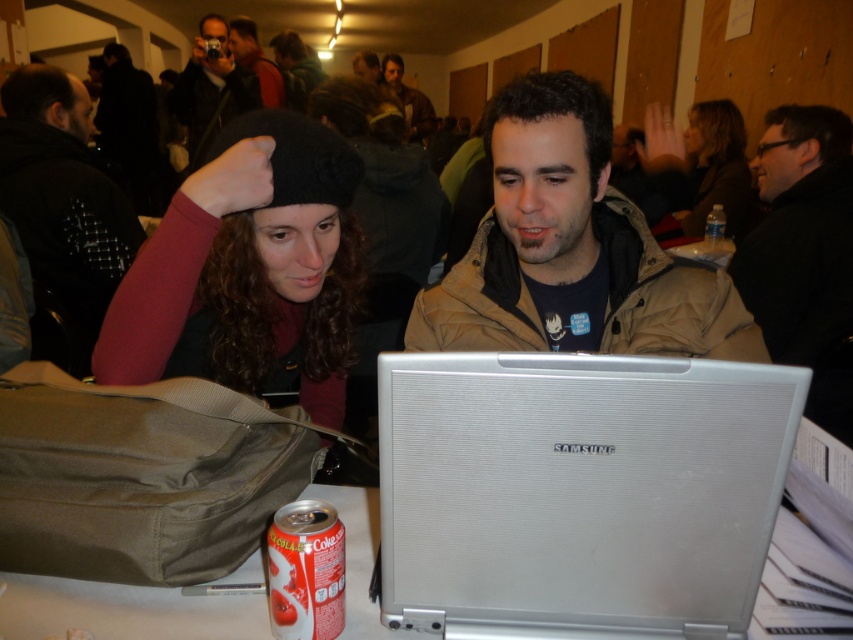
You are a photographer at the event and need to place both the matte black camera at upper center and the clear plastic bottle at upper right on a shelf. The shelf has a height limit of 12 inches. Which item might not fit if placed upright?

The matte black camera at upper center is much taller than the clear plastic bottle at upper right. Since the shelf has a height limit of 12 inches, the matte black camera at upper center might not fit if placed upright.

You are setting up a photo shoot in the described scene. The matte black camera at upper center needs to be moved to a new position that is closer to the laptop screen. Which object should you adjust the camera position relative to, and why?

The matte black camera at upper center should be moved closer to the laptop screen. Since the camera is currently at point (212, 88), adjusting its position towards the laptop would place it nearer to the screen, fulfilling the requirement for the photo shoot setup.

You are setting up a photography setup for a product shoot. You have a matte black camera at upper center and a clear plastic bottle at upper right. Which object should you place on the left side of the product to avoid blocking the camera lens, and why?

You should place the clear plastic bottle at upper right on the left side of the product because the matte black camera at upper center is wider and might block the lens if placed closer. Since the clear plastic bottle at upper right is narrower, it is less likely to obstruct the camera lens when positioned to the left of the product.